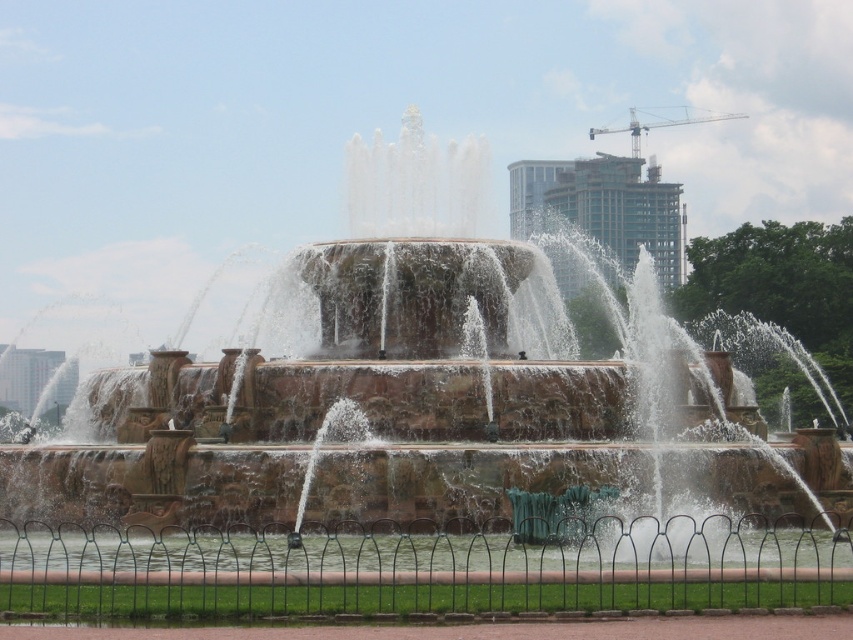
You are a park maintenance worker who needs to ensure that the brown stone fountain at center and the clear water at center are within the park boundaries. Given that the park fence is black metal and curves around the fountain, can you confirm if both objects are entirely within the fence?

The brown stone fountain at center has a larger width than the clear water at center. Since the fence curves around the fountain, which is wider, it is likely that both the brown stone fountain at center and the clear water at center are entirely within the fence as the fence accommodates the larger width of the fountain.

You are standing at the point labeled as point (x=430, y=401) in the image. What object are you directly facing?

The point (x=430, y=401) indicates the brown stone fountain at center, so you are directly facing the brown stone fountain at center.